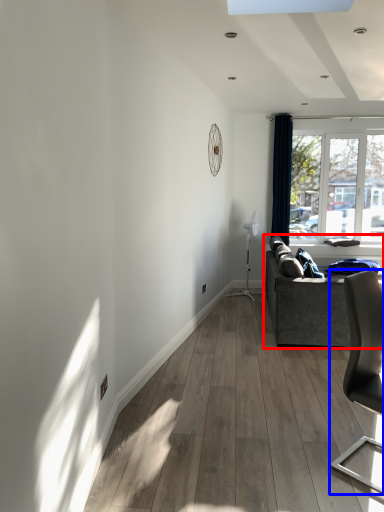
Question: Which point is closer to the camera, studio couch (highlighted by a red box) or chair (highlighted by a blue box)?

Choices:
 (A) studio couch
 (B) chair

Answer: (B)